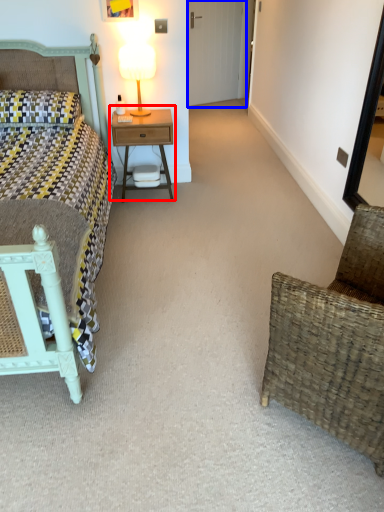
Question: Which of the following is the farthest to the observer, nightstand (highlighted by a red box) or glass door (highlighted by a blue box)?

Choices:
 (A) nightstand
 (B) glass door

Answer: (B)